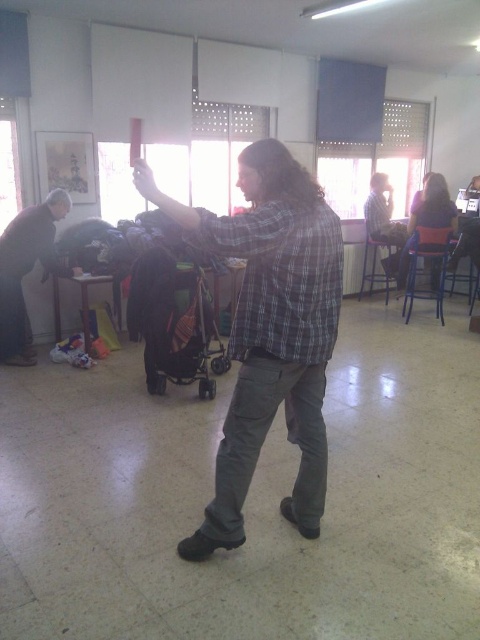
You are organizing a clothing donation drive and need to stack the plaid fabric shirt at center and the blue denim shirt at center. Based on their positions in the image, which shirt should you place on top to match their arrangement?

The blue denim shirt at center should be placed on top since the plaid fabric shirt at center is located below it in the image.

You are standing in the room and want to reach both the point at coordinates (300, 284) and the point at coordinates (47, 204). Which point will you reach first?

You will reach point (300, 284) first because it is closer to you than point (47, 204).